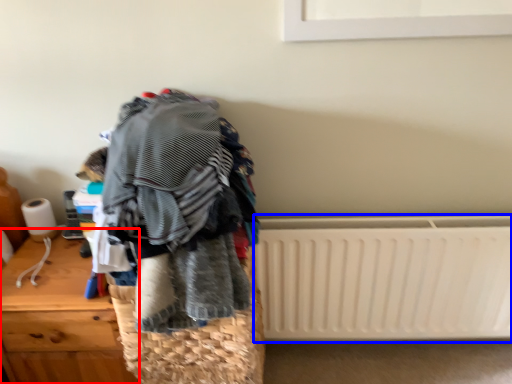
Question: Which object appears closest to the camera in this image, furniture (highlighted by a red box) or radiator (highlighted by a blue box)?

Choices:
 (A) furniture
 (B) radiator

Answer: (A)